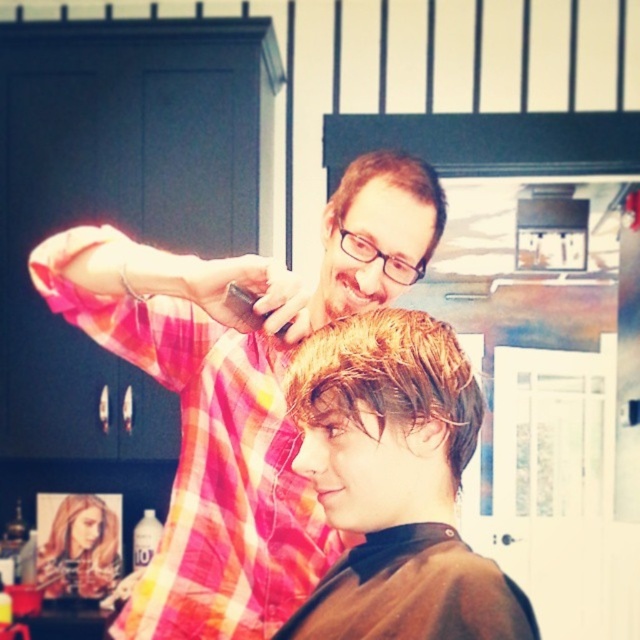
Does shiny blonde hair at center appear on the left side of blonde hair at upper left?

In fact, shiny blonde hair at center is to the right of blonde hair at upper left.

Does shiny blonde hair at center have a greater width compared to blonde hair at upper left?

No, shiny blonde hair at center is not wider than blonde hair at upper left.

Is point (330, 326) more distant than point (65, 593)?

No, it is in front of (65, 593).

The image size is (640, 640). In order to click on shiny blonde hair at center in this screenshot , I will do `click(388, 380)`.

Does point (54, 310) come farther from viewer compared to point (337, 196)?

Yes, it is behind point (337, 196).

Between pink plaid shirt at upper left and matte black hair clipper at upper center, which one appears on the right side from the viewer's perspective?

From the viewer's perspective, matte black hair clipper at upper center appears more on the right side.

The height and width of the screenshot is (640, 640). Find the location of `pink plaid shirt at upper left`. pink plaid shirt at upper left is located at coordinates (237, 392).

Is shiny blonde hair at center bigger than matte black hair clipper at upper center?

No, shiny blonde hair at center is not bigger than matte black hair clipper at upper center.

Is shiny blonde hair at center positioned at the back of matte black hair clipper at upper center?

No, it is in front of matte black hair clipper at upper center.

Locate an element on the screen. This screenshot has width=640, height=640. shiny blonde hair at center is located at coordinates (388, 380).

Identify the location of shiny blonde hair at center. The image size is (640, 640). (388, 380).